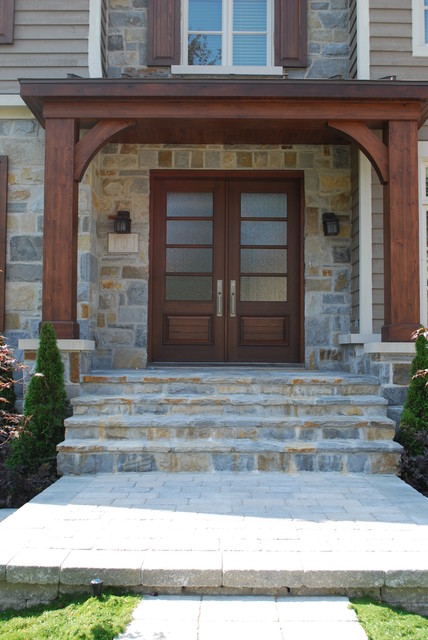
Identify the location of wood pillars. (57, 264), (398, 276).